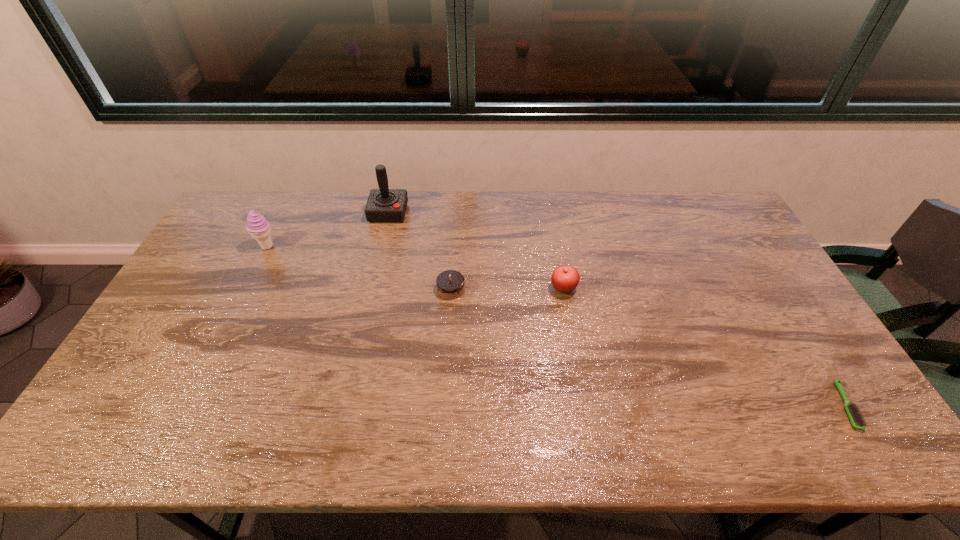
At what (x,y) coordinates should I click in order to perform the action: click on the tallest object. Please return your answer as a coordinate pair (x, y). This screenshot has width=960, height=540. Looking at the image, I should click on (383, 205).

This screenshot has width=960, height=540. In order to click on the second object from left to right in this screenshot , I will do `click(383, 205)`.

Identify the location of the second tallest object. (259, 228).

What are the coordinates of `the fourth nearest object` in the screenshot? It's located at (259, 228).

Find the location of a particular element. The width and height of the screenshot is (960, 540). the third shortest object is located at coordinates (565, 279).

This screenshot has width=960, height=540. What are the coordinates of `apple` in the screenshot? It's located at (565, 279).

Where is `the third object from right to left`? Image resolution: width=960 pixels, height=540 pixels. the third object from right to left is located at coordinates (450, 284).

Identify the location of chocolate cake. The width and height of the screenshot is (960, 540). (450, 284).

At what (x,y) coordinates should I click in order to perform the action: click on hairbrush. Please return your answer as a coordinate pair (x, y). This screenshot has width=960, height=540. Looking at the image, I should click on pos(856,419).

At what (x,y) coordinates should I click in order to perform the action: click on the shortest object. Please return your answer as a coordinate pair (x, y). Image resolution: width=960 pixels, height=540 pixels. Looking at the image, I should click on (856, 419).